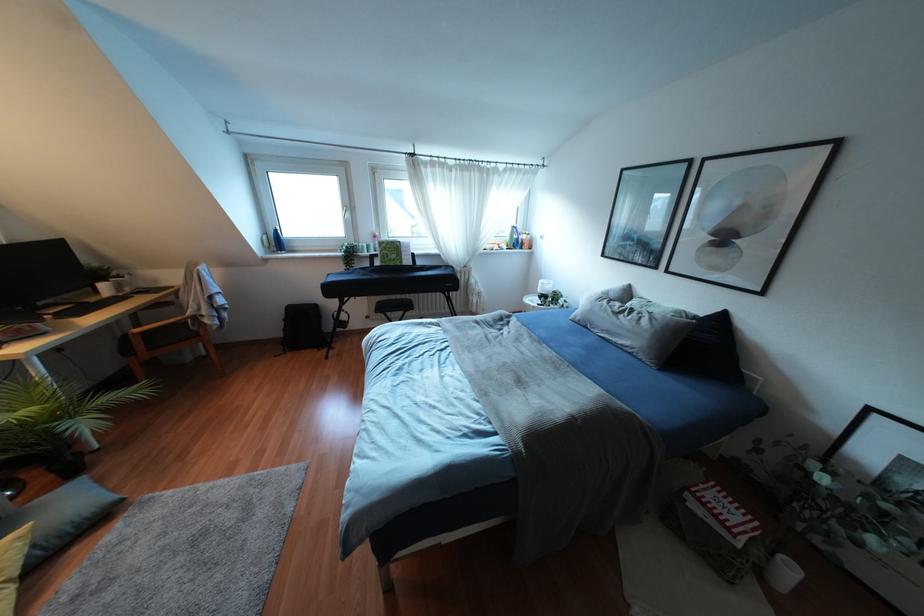
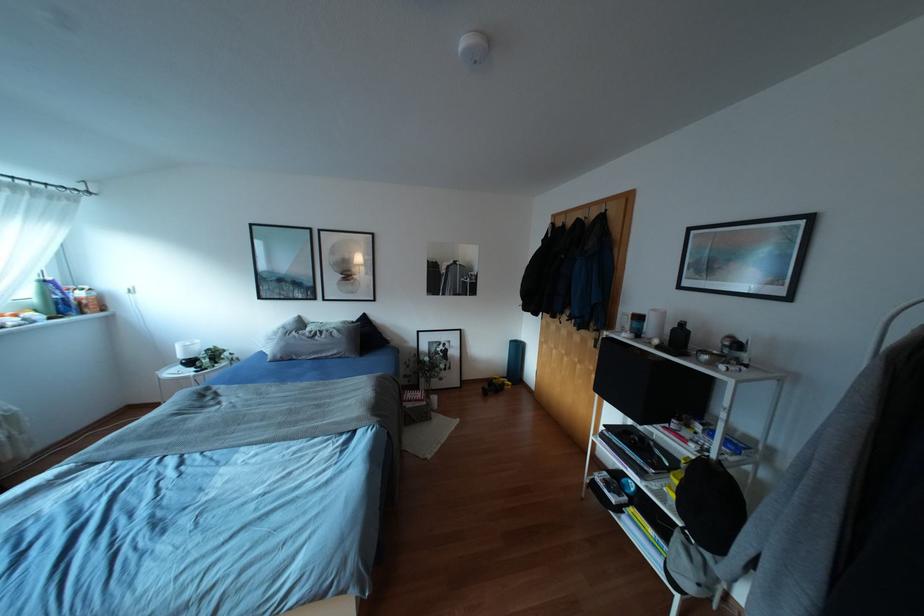
Question: The camera is either moving clockwise (left) or counter-clockwise (right) around the object. The first image is from the beginning of the video and the second image is from the end. Is the camera moving left or right when shooting the video?

Choices:
 (A) Left
 (B) Right

Answer: (A)